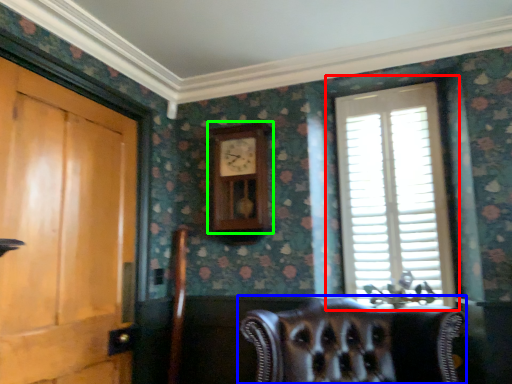
Question: Which is farther away from window (highlighted by a red box)? chair (highlighted by a blue box) or clock (highlighted by a green box)?

Choices:
 (A) chair
 (B) clock

Answer: (A)